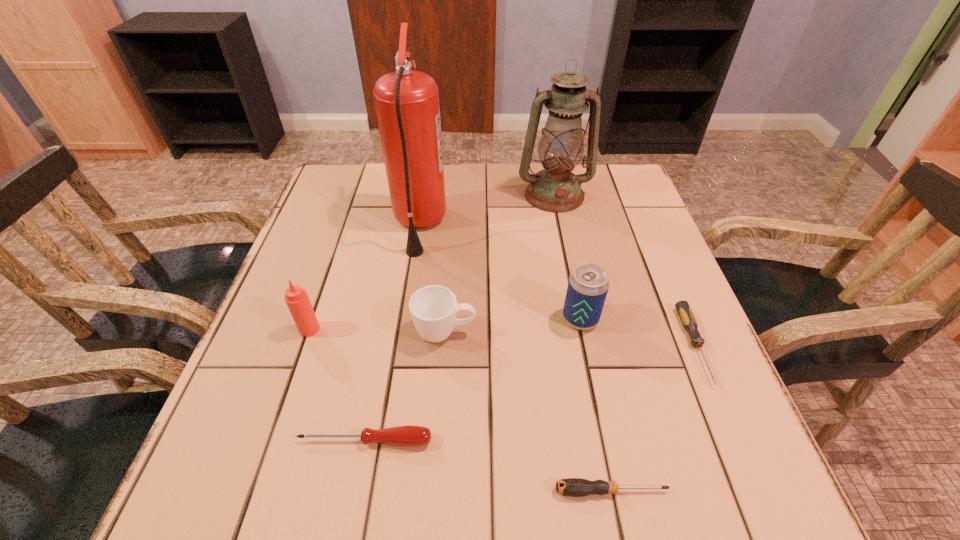
The image size is (960, 540). What are the coordinates of `the second screwdriver from right to left` in the screenshot? It's located at (574, 487).

This screenshot has width=960, height=540. Find the location of `free spot located 0.350m on the instruction side of the fire extinguisher`. free spot located 0.350m on the instruction side of the fire extinguisher is located at coordinates (583, 225).

This screenshot has height=540, width=960. What are the coordinates of `vacant region located 0.290m on the left of the oil lamp` in the screenshot? It's located at (413, 195).

At what (x,y) coordinates should I click in order to perform the action: click on vacant space positioned on the right of the leftmost object. Please return your answer as a coordinate pair (x, y). Looking at the image, I should click on (498, 329).

You are a GUI agent. You are given a task and a screenshot of the screen. Output one action in this format:
    pyautogui.click(x=<x>, y=<y>)
    Task: Click on the vacant region located 0.070m on the front of the beer can
    This screenshot has width=960, height=540.
    Given the screenshot: What is the action you would take?
    pyautogui.click(x=589, y=362)

Where is `free space located 0.130m with the handle on the side of the cup`? The height and width of the screenshot is (540, 960). free space located 0.130m with the handle on the side of the cup is located at coordinates (541, 333).

Locate an element on the screen. This screenshot has height=540, width=960. vacant region located on the front of the second nearest object is located at coordinates (356, 490).

You are a GUI agent. You are given a task and a screenshot of the screen. Output one action in this format:
    pyautogui.click(x=<x>, y=<y>)
    Task: Click on the free space located 0.200m insert the rightmost screwdriver into a screw head
    This screenshot has width=960, height=540.
    Given the screenshot: What is the action you would take?
    pyautogui.click(x=763, y=509)

Where is `free spot located on the back of the nearest screwdriver`? free spot located on the back of the nearest screwdriver is located at coordinates (579, 332).

The image size is (960, 540). I want to click on fire extinguisher at the far edge, so tap(407, 105).